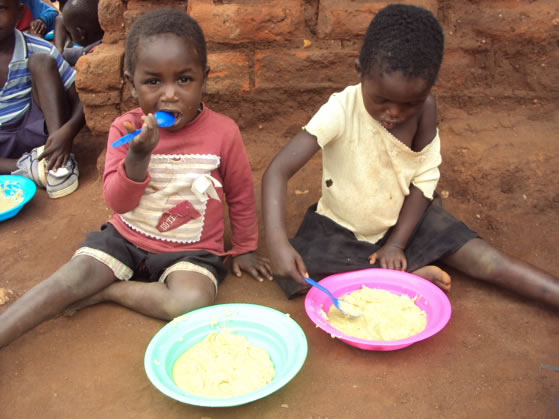
What are the coordinates of `green plate` in the screenshot? It's located at (290, 341).